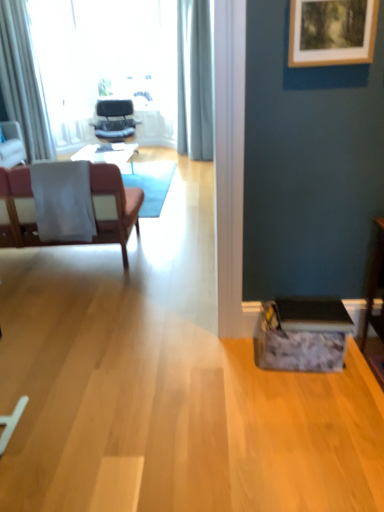
Identify the location of vacant area that is in front of pink fabric chair at left, arranged as the 3th chair when viewed from the top. The image size is (384, 512). (67, 298).